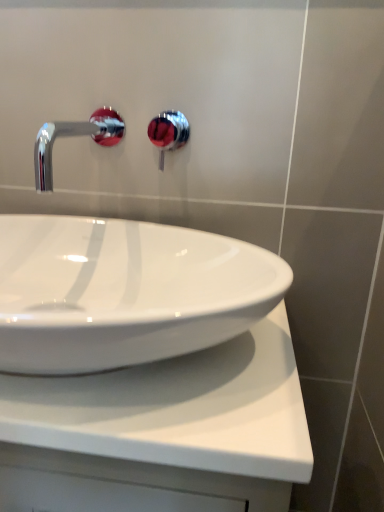
Question: Is chrome/metallic faucet at upper left inside the boundaries of chrome/red faucet at upper center, or outside?

Choices:
 (A) inside
 (B) outside

Answer: (B)

Question: From their relative heights in the image, would you say chrome/metallic faucet at upper left is taller or shorter than chrome/red faucet at upper center?

Choices:
 (A) tall
 (B) short

Answer: (B)

Question: Estimate the real-world distances between objects in this image. Which object is farther from the chrome/metallic faucet at upper left?

Choices:
 (A) chrome/red faucet at upper center
 (B) white glossy countertop at center

Answer: (A)

Question: Estimate the real-world distances between objects in this image. Which object is closer to the white glossy countertop at center?

Choices:
 (A) chrome/metallic faucet at upper left
 (B) chrome/red faucet at upper center

Answer: (A)